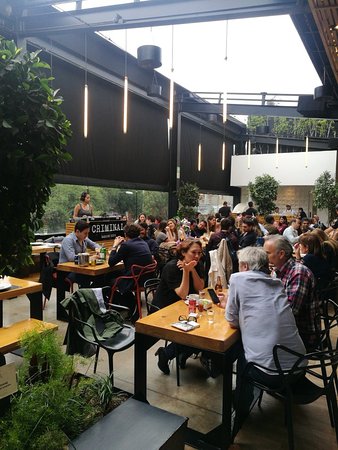
Where is `lights`? This screenshot has height=450, width=338. lights is located at coordinates (84, 123), (125, 113), (169, 108), (225, 107), (195, 160), (229, 157), (223, 162), (249, 155), (274, 150), (306, 150).